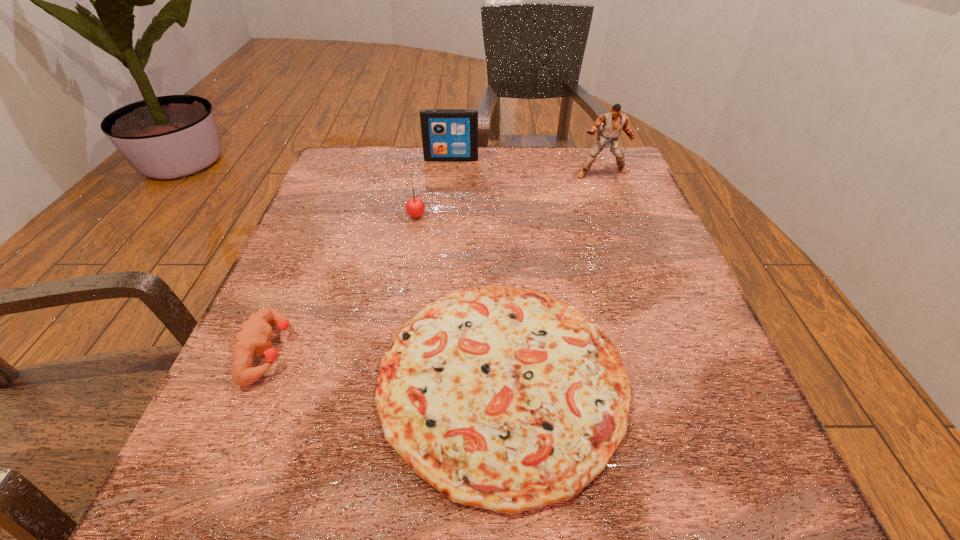
Find the location of a particular element. the farther puncher is located at coordinates (613, 122).

Locate an element on the screen. Image resolution: width=960 pixels, height=540 pixels. the taller puncher is located at coordinates (613, 122).

This screenshot has height=540, width=960. In order to click on iPod in this screenshot , I will do `click(447, 134)`.

The height and width of the screenshot is (540, 960). What are the coordinates of `the farthest object` in the screenshot? It's located at (447, 134).

Where is `the third shortest object`? the third shortest object is located at coordinates [415, 207].

Locate an element on the screen. This screenshot has height=540, width=960. cherry is located at coordinates (415, 207).

Locate an element on the screen. This screenshot has height=540, width=960. the fourth tallest object is located at coordinates (253, 337).

Locate an element on the screen. Image resolution: width=960 pixels, height=540 pixels. the nearer puncher is located at coordinates (253, 337).

Where is `the shortest object`? The width and height of the screenshot is (960, 540). the shortest object is located at coordinates (502, 398).

Locate an element on the screen. The width and height of the screenshot is (960, 540). vacant point located 0.150m on the front-facing side of the fourth nearest object is located at coordinates (618, 218).